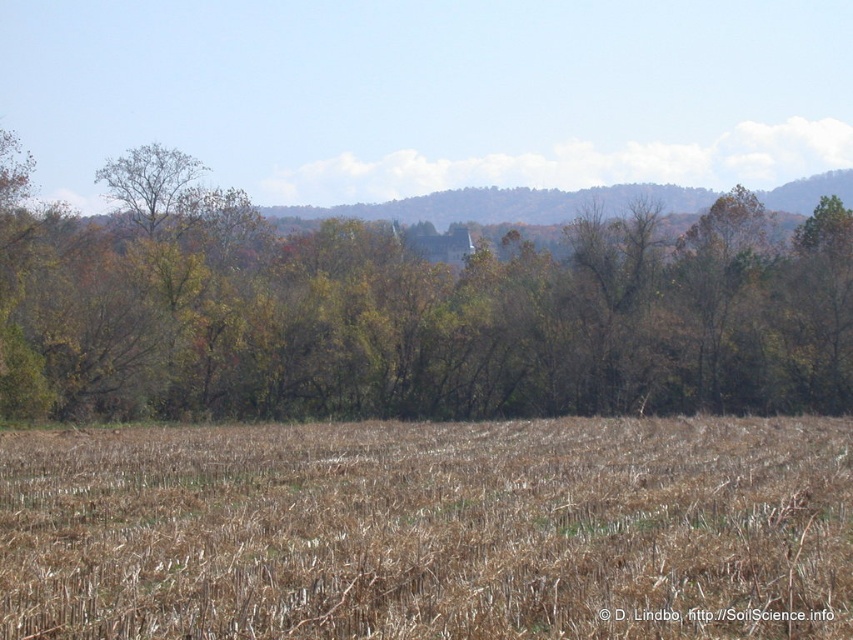
Question: Does brown dry grass at center appear over green leafy tree at center?

Choices:
 (A) yes
 (B) no

Answer: (B)

Question: Among these points, which one is nearest to the camera?

Choices:
 (A) (583, 392)
 (B) (198, 584)

Answer: (B)

Question: Among these objects, which one is farthest from the camera?

Choices:
 (A) green leafy tree at center
 (B) brown dry grass at center

Answer: (A)

Question: Is brown dry grass at center wider than green leafy tree at center?

Choices:
 (A) no
 (B) yes

Answer: (A)

Question: Which object appears closest to the camera in this image?

Choices:
 (A) green leafy tree at center
 (B) brown dry grass at center

Answer: (B)

Question: Does brown dry grass at center have a larger size compared to green leafy tree at center?

Choices:
 (A) yes
 (B) no

Answer: (B)